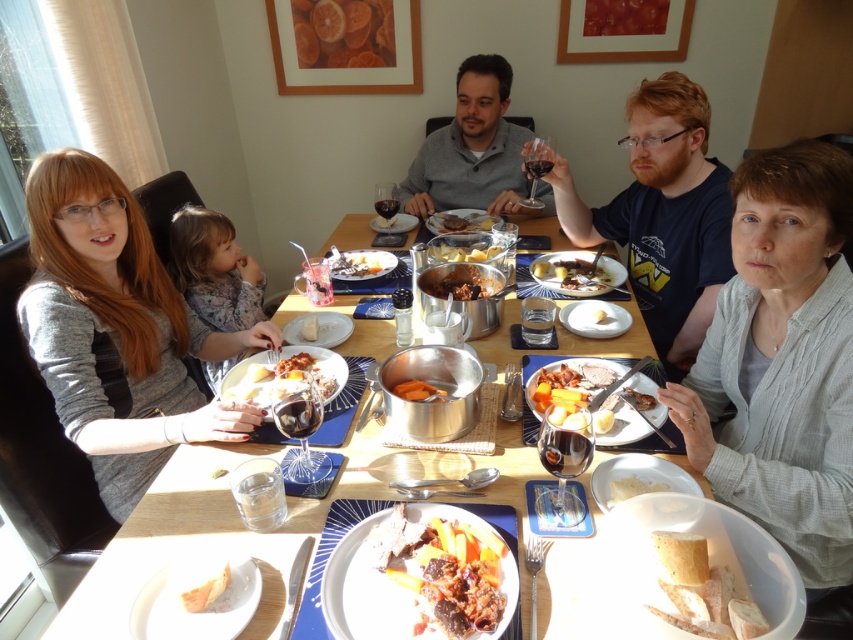
You are sitting at the wooden table with a blue patterned tablecloth and want to pass a dish from one point to another. If you start at point (376, 525) and move towards point (636, 380), will you be moving forward or backward relative to your sitting position?

Since point (376, 525) is in front of point (636, 380), moving from point (376, 525) to point (636, 380) would mean moving backward relative to your sitting position.

You are a photographer setting up a shot of the dining table. You need to ensure that the gray knit sweater at lower right is visible in the frame without blocking the brown matte stew at center. Based on their positions, is this possible?

The gray knit sweater at lower right is located below the brown matte stew at center, so it won not block the stew. Therefore, the sweater can be visible in the frame without obstructing the stew.

You are standing at the point labeled point (x=252, y=356) and want to take a photo of the dining table. The camera you have can only focus on objects within 1.5 meters. Will the camera be able to focus on the dining table?

The distance between point (x=252, y=356) and the camera is 1.54 meters, which is slightly beyond the camera focus range of 1.5 meters. Therefore, the camera will not be able to focus on the dining table.